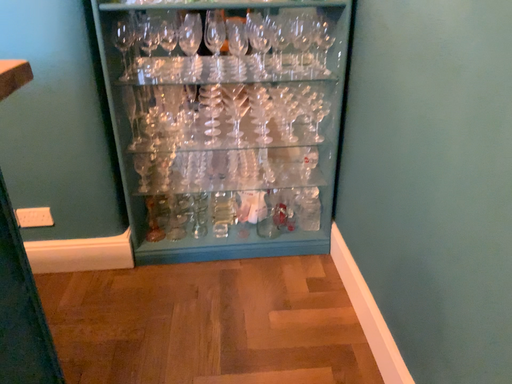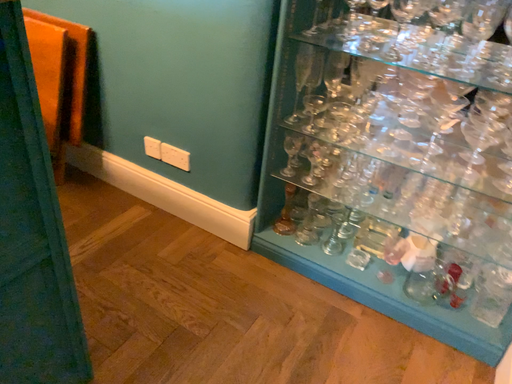
Question: Which way did the camera rotate in the video?

Choices:
 (A) rotated left
 (B) rotated right

Answer: (A)